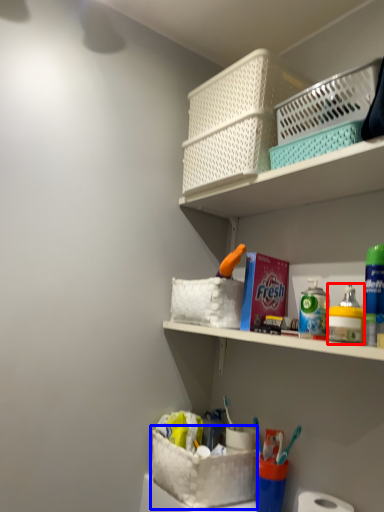
Question: Which object is further to the camera taking this photo, toiletry (highlighted by a red box) or basket container (highlighted by a blue box)?

Choices:
 (A) toiletry
 (B) basket container

Answer: (B)